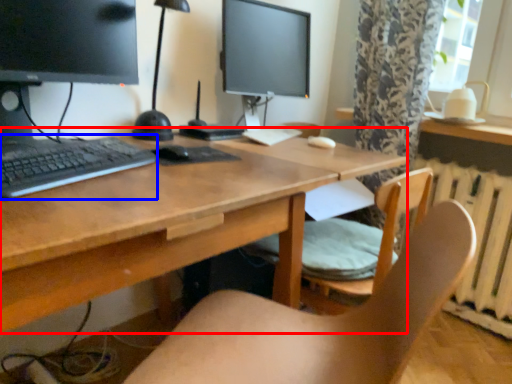
Question: Among these objects, which one is nearest to the camera, desk (highlighted by a red box) or computer keyboard (highlighted by a blue box)?

Choices:
 (A) desk
 (B) computer keyboard

Answer: (A)